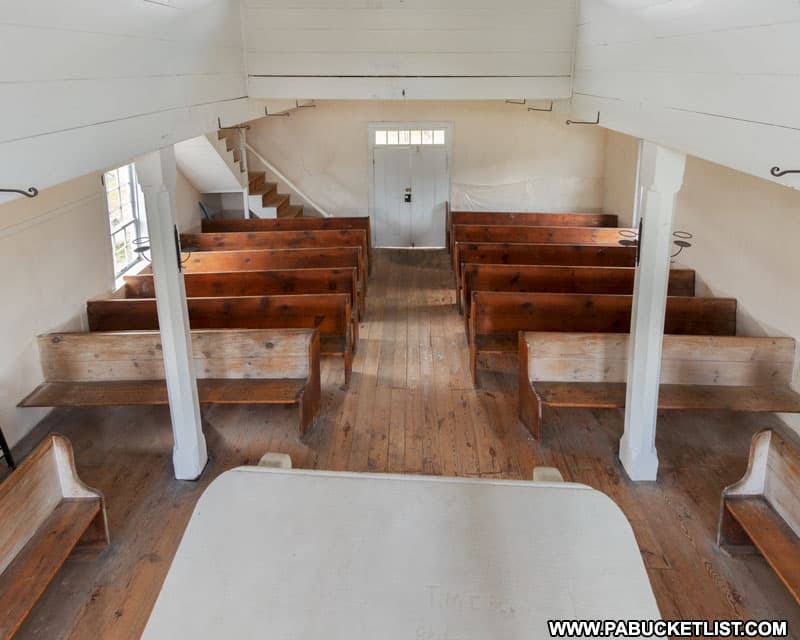
Where is `door`? Image resolution: width=800 pixels, height=640 pixels. door is located at coordinates (424, 207), (398, 212).